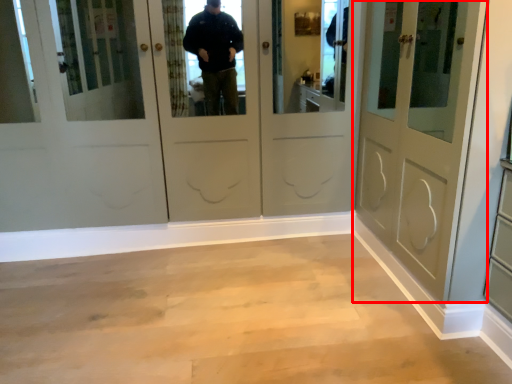
Question: From the image's perspective, what is the correct spatial relationship of door (annotated by the red box) in relation to corridor?

Choices:
 (A) above
 (B) below

Answer: (A)